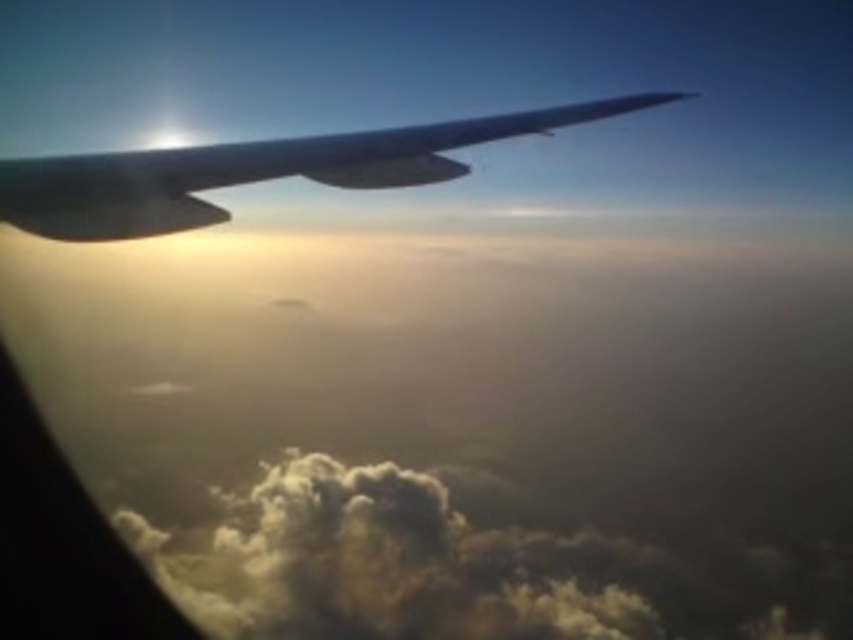
You are a passenger on an airplane and looking out the window. You see the cloudy white at lower left and the satin black wing at upper left. Which object is positioned to the right side of the other?

The cloudy white at lower left is to the right of the satin black wing at upper left.

Based on the photo, you are a passenger on the aircraft and want to know which of the two points, point (453,588) or point (161,195), is closer to the airplane wing. Based on the coordinates and the scene description, which point is closer to the wing?

Point (161,195) is closer to the airplane wing because it is in front of point (453,588), which is behind it.